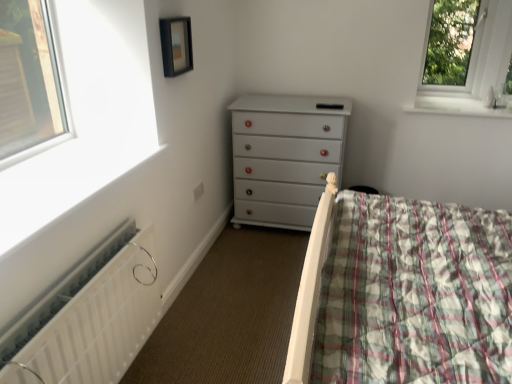
You are a GUI agent. You are given a task and a screenshot of the screen. Output one action in this format:
    pyautogui.click(x=<x>, y=<y>)
    Task: Click on the transparent glass window at upper right
    This screenshot has height=384, width=512.
    Given the screenshot: What is the action you would take?
    pyautogui.click(x=467, y=59)

Locate an element on the screen. Image resolution: width=512 pixels, height=384 pixels. matte black picture frame at upper center is located at coordinates (176, 45).

Which object is more forward, white matte radiator at lower left or transparent glass window at upper right?

white matte radiator at lower left.

Is there a large distance between white matte radiator at lower left and transparent glass window at upper right?

Absolutely, white matte radiator at lower left is distant from transparent glass window at upper right.

Where is `window on the right of white matte radiator at lower left`? window on the right of white matte radiator at lower left is located at coordinates (467, 59).

From a real-world perspective, is white matte radiator at lower left located beneath transparent glass window at upper right?

Yes, from a real-world perspective, white matte radiator at lower left is below transparent glass window at upper right.

Which object is more forward, transparent glass window at upper right or matte black picture frame at upper center?

matte black picture frame at upper center is more forward.

Between transparent glass window at upper right and matte black picture frame at upper center, which one has larger width?

transparent glass window at upper right is wider.

Which of these two, transparent glass window at upper right or matte black picture frame at upper center, stands shorter?

matte black picture frame at upper center.

Consider the image. Considering the sizes of objects transparent glass window at upper right and matte black picture frame at upper center in the image provided, who is bigger, transparent glass window at upper right or matte black picture frame at upper center?

With larger size is transparent glass window at upper right.

Which is behind, white painted wood chest of drawers at center or white glossy window sill at upper right?

white glossy window sill at upper right is further from the camera.

From a real-world perspective, which object stands above the other?

white glossy window sill at upper right is physically above.

Considering the points (252, 208) and (480, 113), which point is in front, point (252, 208) or point (480, 113)?

The point (480, 113) is closer to the camera.

Would you say white matte radiator at lower left is part of transparent glass window at upper right's contents?

No, transparent glass window at upper right does not contain white matte radiator at lower left.

Considering the relative sizes of transparent glass window at upper right and white matte radiator at lower left in the image provided, is transparent glass window at upper right taller than white matte radiator at lower left?

Yes, transparent glass window at upper right is taller than white matte radiator at lower left.

From the image's perspective, is transparent glass window at upper right over white matte radiator at lower left?

Yes, from the image's perspective, transparent glass window at upper right is over white matte radiator at lower left.

Which of these two, transparent glass window at upper right or white matte radiator at lower left, is bigger?

white matte radiator at lower left.

From a real-world perspective, is white matte radiator at lower left located beneath white painted wood chest of drawers at center?

Yes.

Considering the relative positions of white matte radiator at lower left and white painted wood chest of drawers at center in the image provided, is white matte radiator at lower left to the left of white painted wood chest of drawers at center from the viewer's perspective?

Yes.

Which is correct: white matte radiator at lower left is inside white painted wood chest of drawers at center, or outside of it?

white matte radiator at lower left cannot be found inside white painted wood chest of drawers at center.

From a real-world perspective, is white painted wood chest of drawers at center located higher than matte black picture frame at upper center?

No.

Who is shorter, white painted wood chest of drawers at center or matte black picture frame at upper center?

matte black picture frame at upper center.

From the image's perspective, is white painted wood chest of drawers at center below matte black picture frame at upper center?

Correct, white painted wood chest of drawers at center appears lower than matte black picture frame at upper center in the image.

From a real-world perspective, does white glossy window sill at upper right stand above matte black picture frame at upper center?

No, from a real-world perspective, white glossy window sill at upper right is not on top of matte black picture frame at upper center.

Considering the relative sizes of white glossy window sill at upper right and matte black picture frame at upper center in the image provided, is white glossy window sill at upper right shorter than matte black picture frame at upper center?

Yes.

Does white glossy window sill at upper right appear on the right side of matte black picture frame at upper center?

Yes.

Where is `window above the white matte radiator at lower left (from the image's perspective)`? The width and height of the screenshot is (512, 384). window above the white matte radiator at lower left (from the image's perspective) is located at coordinates (467, 59).

Identify the location of picture frame lying in front of the transparent glass window at upper right. (176, 45).

Looking at the image, which one is located further to white matte radiator at lower left, white glossy window sill at upper right or transparent glass window at upper right?

Among the two, transparent glass window at upper right is located further to white matte radiator at lower left.

Based on their spatial positions, is matte black picture frame at upper center or white glossy window sill at upper right closer to transparent glass window at upper right?

Among the two, white glossy window sill at upper right is located nearer to transparent glass window at upper right.

Considering their positions, is white glossy window sill at upper right positioned closer to white matte radiator at lower left than white painted wood chest of drawers at center?

white painted wood chest of drawers at center lies closer to white matte radiator at lower left than the other object.

When comparing their distances from matte black picture frame at upper center, does transparent glass window at upper right or white painted wood chest of drawers at center seem further?

Based on the image, transparent glass window at upper right appears to be further to matte black picture frame at upper center.

Which object lies nearer to the anchor point transparent glass window at upper right, white matte radiator at lower left or matte black picture frame at upper center?

matte black picture frame at upper center is closer to transparent glass window at upper right.

From the image, which object appears to be nearer to matte black picture frame at upper center, white matte radiator at lower left or white glossy window sill at upper right?

Based on the image, white matte radiator at lower left appears to be nearer to matte black picture frame at upper center.

When comparing their distances from transparent glass window at upper right, does white painted wood chest of drawers at center or matte black picture frame at upper center seem further?

matte black picture frame at upper center lies further to transparent glass window at upper right than the other object.

Considering their positions, is white glossy window sill at upper right positioned closer to white painted wood chest of drawers at center than matte black picture frame at upper center?

white glossy window sill at upper right is positioned closer to the anchor white painted wood chest of drawers at center.

Find the location of a particular element. Image resolution: width=512 pixels, height=384 pixels. window sill between matte black picture frame at upper center and transparent glass window at upper right from left to right is located at coordinates (456, 107).

The width and height of the screenshot is (512, 384). Identify the location of picture frame located between white matte radiator at lower left and transparent glass window at upper right in the left-right direction. (176, 45).

At what (x,y) coordinates should I click in order to perform the action: click on window sill located between white painted wood chest of drawers at center and transparent glass window at upper right in the left-right direction. Please return your answer as a coordinate pair (x, y). Looking at the image, I should click on (456, 107).

Find the location of a particular element. The height and width of the screenshot is (384, 512). picture frame between white matte radiator at lower left and white painted wood chest of drawers at center from front to back is located at coordinates (176, 45).